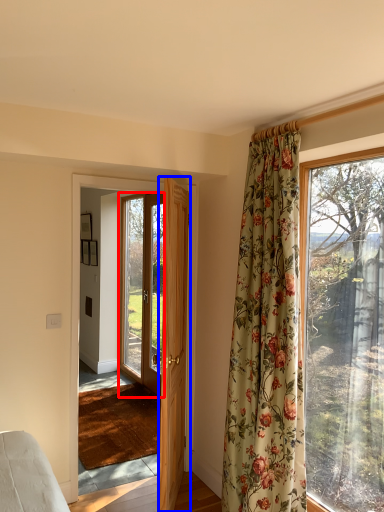
Question: Which point is further to the camera, door (highlighted by a red box) or door (highlighted by a blue box)?

Choices:
 (A) door
 (B) door

Answer: (A)